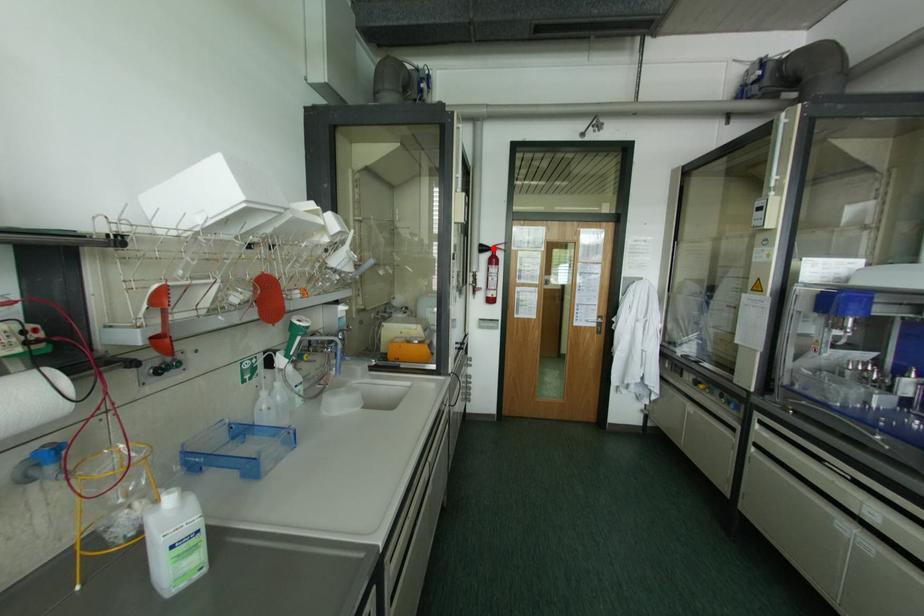
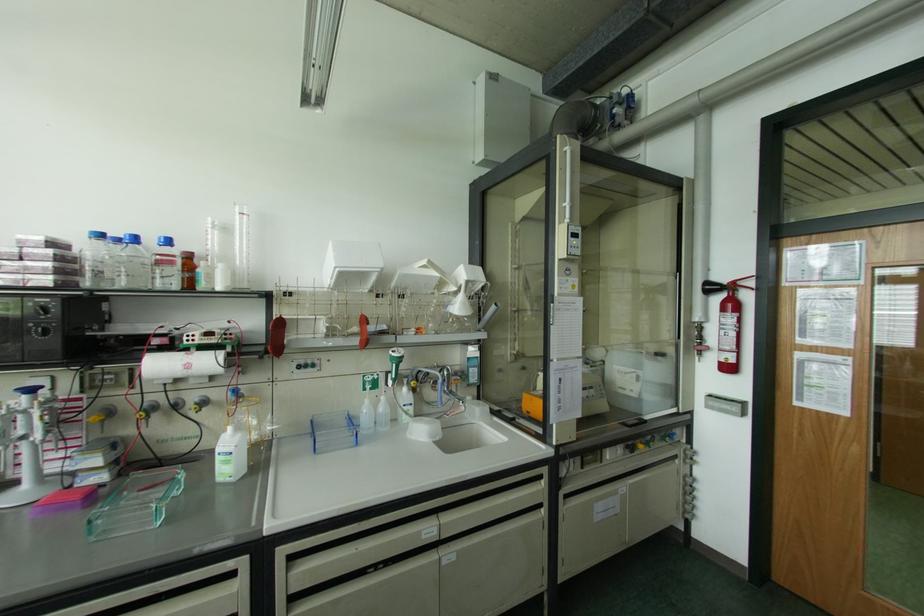
Find the pixel in the second image that matches the highlighted location in the first image.

(732, 286)